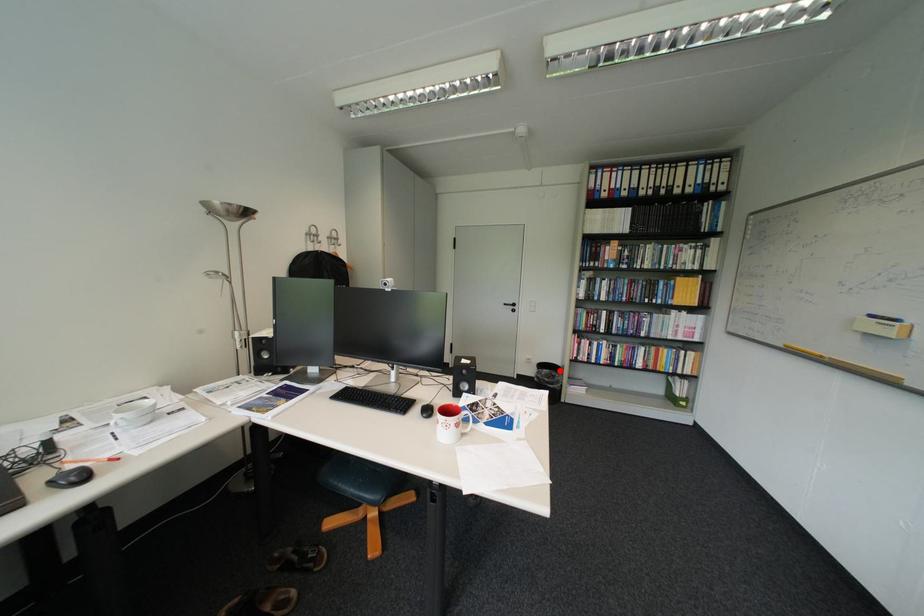
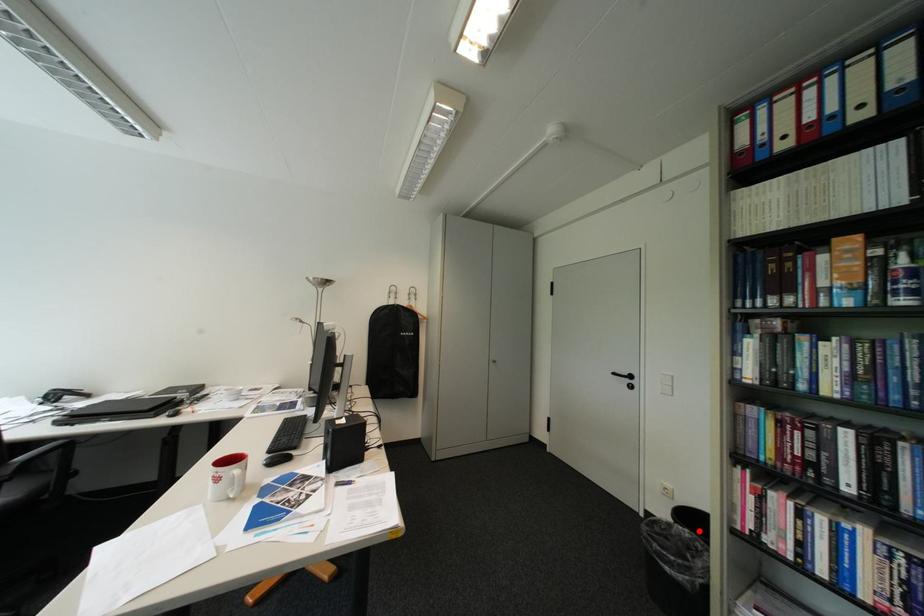
I am providing you with two images of the same scene from different viewpoints. A red point is marked on the first image and another point is marked on the second image. Do the highlighted points in image1 and image2 indicate the same real-world spot?

Yes